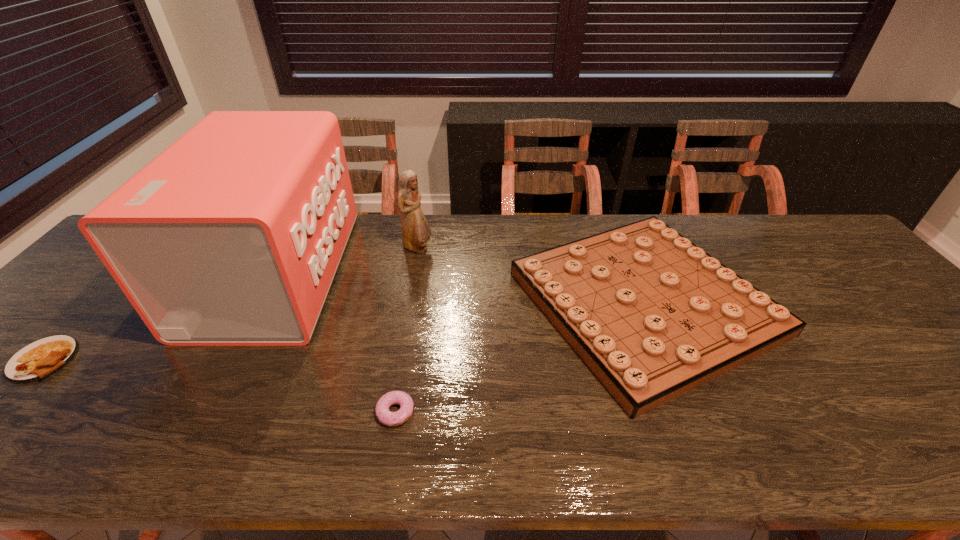
Identify the location of vacant area in the image that satisfies the following two spatial constraints: 1. on the back side of the rightmost object; 2. on the front-facing side of the fourth shortest object. The height and width of the screenshot is (540, 960). (622, 248).

Where is `vacant area that satisfies the following two spatial constraints: 1. on the front-facing side of the doughnut; 2. on the right side of the figurine`? vacant area that satisfies the following two spatial constraints: 1. on the front-facing side of the doughnut; 2. on the right side of the figurine is located at coordinates (389, 411).

The width and height of the screenshot is (960, 540). What are the coordinates of `vacant region that satisfies the following two spatial constraints: 1. on the surface of the doughnut where the text is embossed; 2. on the left side of the second object from left to right` in the screenshot? It's located at (202, 411).

Identify the location of free space that satisfies the following two spatial constraints: 1. on the front-facing side of the figurine; 2. on the left side of the third tallest object. Image resolution: width=960 pixels, height=540 pixels. (408, 303).

Where is `blank area in the image that satisfies the following two spatial constraints: 1. on the back side of the doughnut; 2. on the front-facing side of the figurine`? The image size is (960, 540). blank area in the image that satisfies the following two spatial constraints: 1. on the back side of the doughnut; 2. on the front-facing side of the figurine is located at coordinates (422, 248).

This screenshot has height=540, width=960. In order to click on vacant region that satisfies the following two spatial constraints: 1. on the surface of the second object from left to right where the text is embossed; 2. on the left side of the doughnut in this screenshot , I will do `click(202, 411)`.

This screenshot has height=540, width=960. I want to click on blank space that satisfies the following two spatial constraints: 1. on the back side of the third tallest object; 2. on the right side of the doughnut, so click(413, 303).

You are a GUI agent. You are given a task and a screenshot of the screen. Output one action in this format:
    pyautogui.click(x=<x>, y=<y>)
    Task: Click on the vacant space that satisfies the following two spatial constraints: 1. on the surface of the gameboard where the text is embossed; 2. on the left side of the box
    The width and height of the screenshot is (960, 540).
    Given the screenshot: What is the action you would take?
    pyautogui.click(x=260, y=303)

At what (x,y) coordinates should I click in order to perform the action: click on vacant region that satisfies the following two spatial constraints: 1. on the front-facing side of the second tallest object; 2. on the right side of the doughnut. Please return your answer as a coordinate pair (x, y). The image size is (960, 540). Looking at the image, I should click on (389, 411).